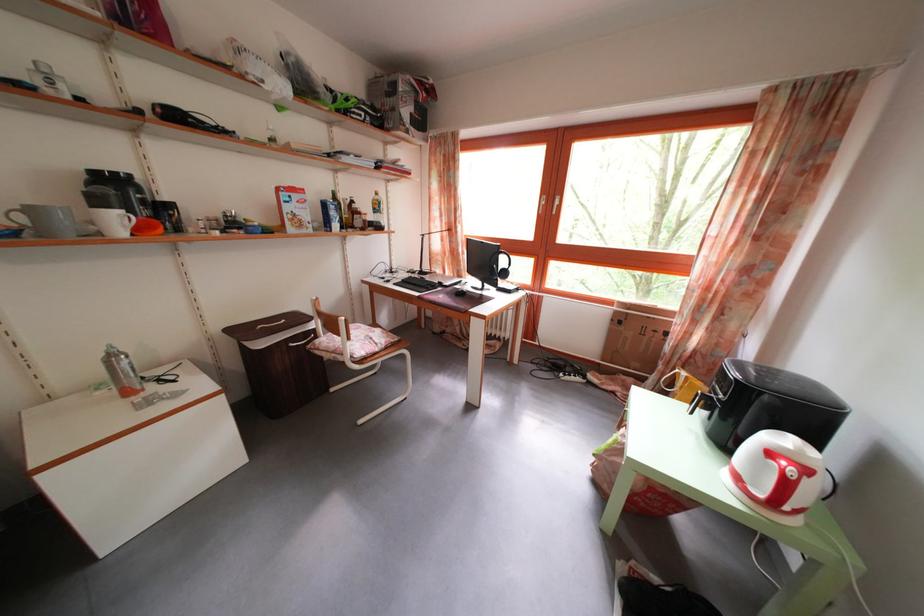
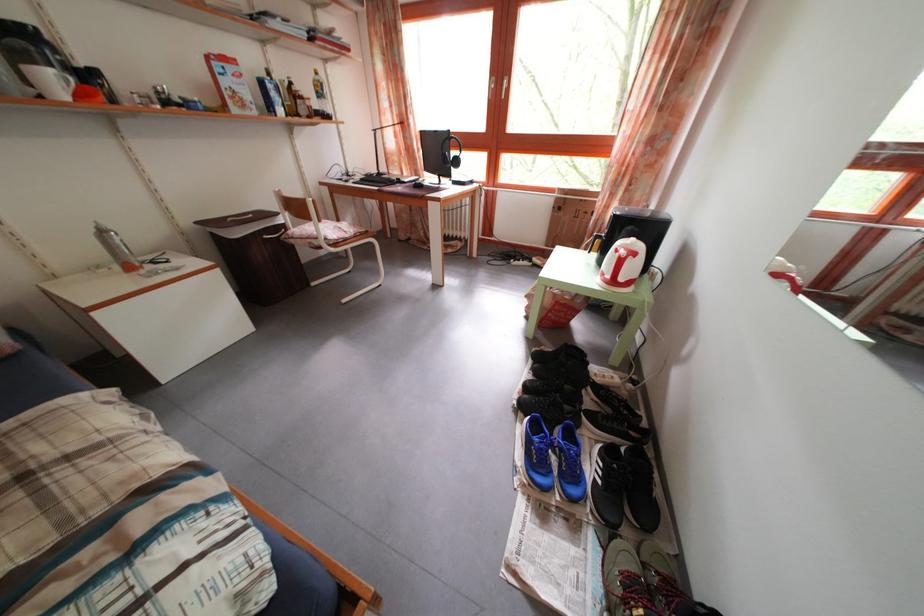
Where in the second image is the point corresponding to [125,227] from the first image?

(58, 87)